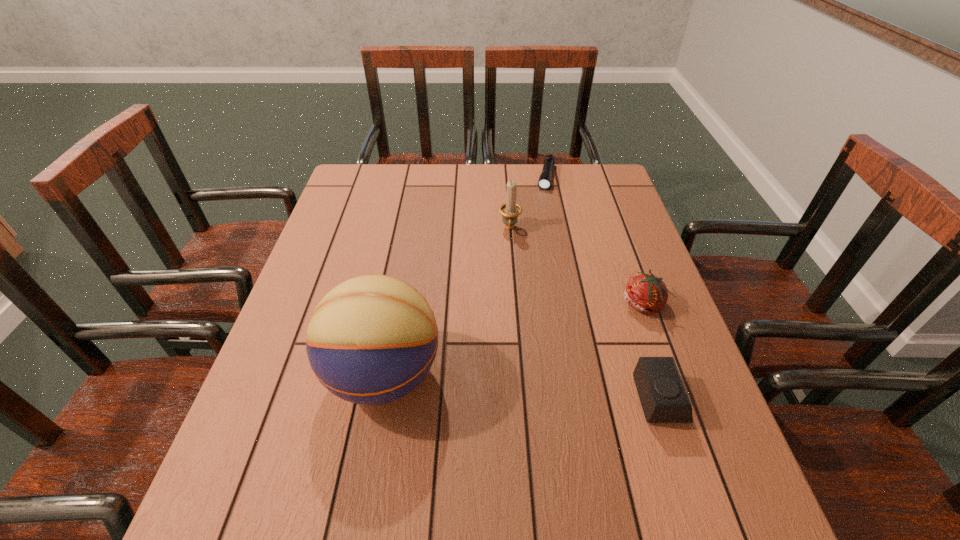
Where is `free space on the desktop that is between the leftmost object and the alarm clock and is positioned on the handle side of the second tallest object`? The image size is (960, 540). free space on the desktop that is between the leftmost object and the alarm clock and is positioned on the handle side of the second tallest object is located at coordinates (503, 386).

Locate an element on the screen. free spot on the desktop that is between the basketball and the alarm clock and is positioned on the front-facing side of the tomato is located at coordinates click(523, 387).

Find the location of a particular element. vacant space on the desktop that is between the tallest object and the alarm clock and is positioned at the lens end of the flashlight is located at coordinates (499, 385).